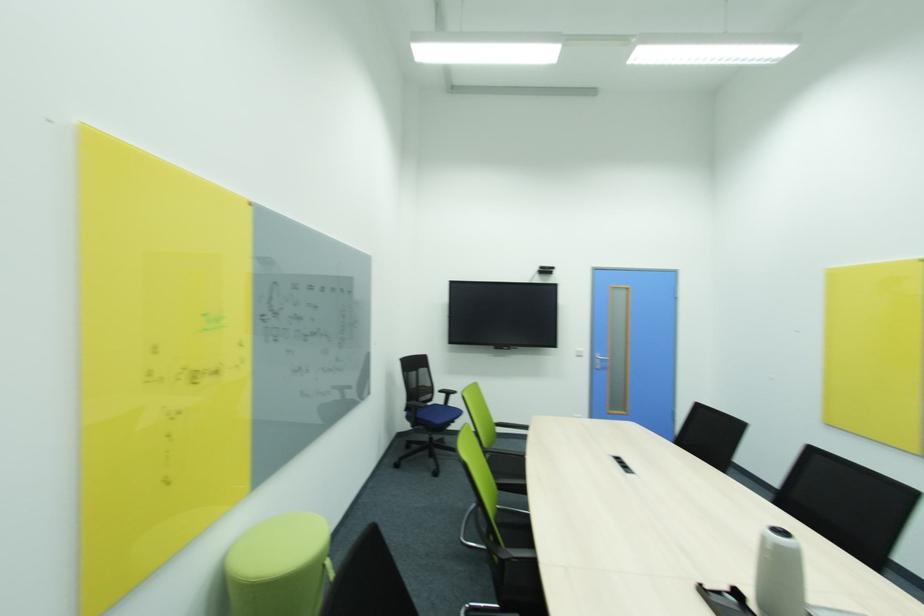
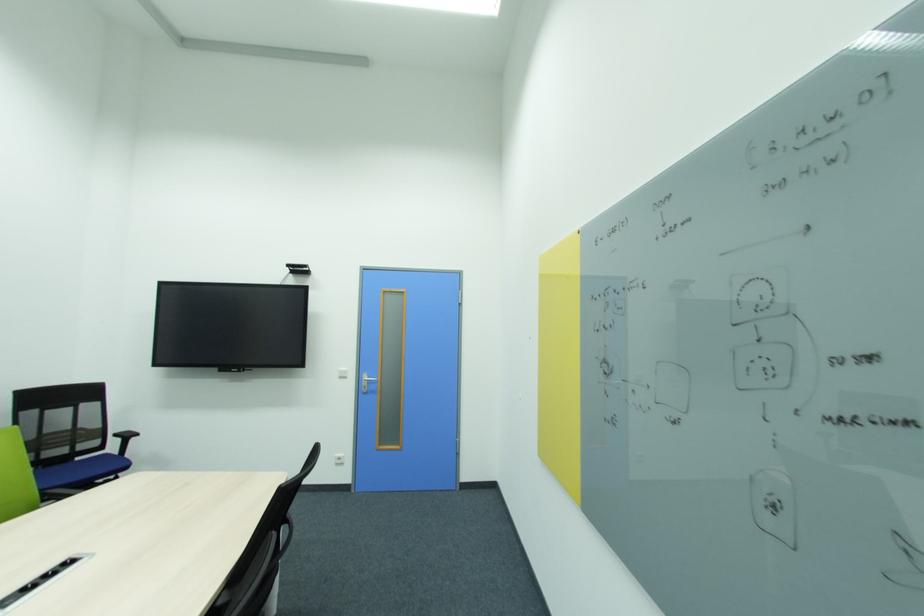
Question: The images are taken continuously from a first-person perspective. In which direction are you moving?

Choices:
 (A) Left
 (B) Right
 (C) Forward
 (D) Backward

Answer: (B)